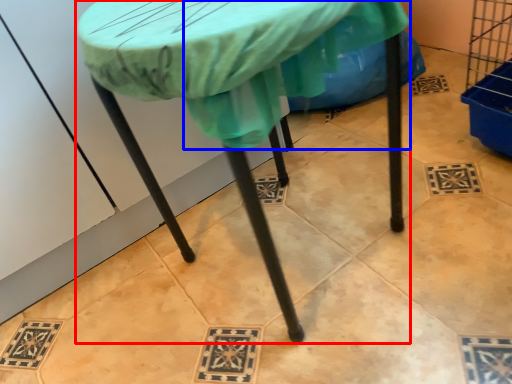
Question: Which point is closer to the camera, table (highlighted by a red box) or fabric (highlighted by a blue box)?

Choices:
 (A) table
 (B) fabric

Answer: (A)